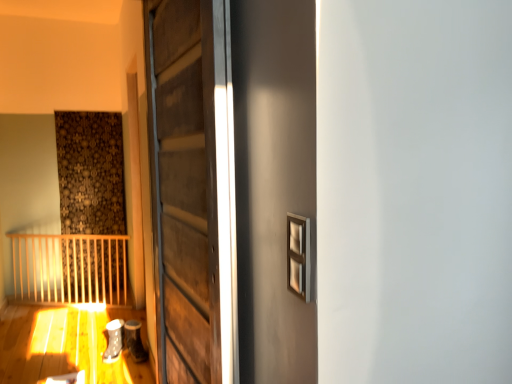
Question: Is wooden door at center positioned in front of white matte shoe at lower left, the 2th shoe positioned from the right?

Choices:
 (A) yes
 (B) no

Answer: (A)

Question: Can you confirm if wooden door at center is taller than white matte shoe at lower left, the 2th shoe positioned from the right?

Choices:
 (A) no
 (B) yes

Answer: (B)

Question: Considering the relative sizes of wooden door at center and white matte shoe at lower left, the 2th shoe positioned from the right, in the image provided, is wooden door at center shorter than white matte shoe at lower left, the 2th shoe positioned from the right,?

Choices:
 (A) no
 (B) yes

Answer: (A)

Question: Considering the relative sizes of wooden door at center and white matte shoe at lower left, acting as the first shoe starting from the left, in the image provided, is wooden door at center thinner than white matte shoe at lower left, acting as the first shoe starting from the left,?

Choices:
 (A) yes
 (B) no

Answer: (A)

Question: From a real-world perspective, is wooden door at center physically above white matte shoe at lower left, acting as the first shoe starting from the left?

Choices:
 (A) no
 (B) yes

Answer: (B)

Question: From their relative heights in the image, would you say matte gray shoe at lower left, the first shoe from the right, is taller or shorter than wooden door at center?

Choices:
 (A) tall
 (B) short

Answer: (B)

Question: Is matte gray shoe at lower left, the first shoe from the right, wider or thinner than wooden door at center?

Choices:
 (A) thin
 (B) wide

Answer: (B)

Question: Visually, is matte gray shoe at lower left, the 2th shoe in the left-to-right sequence, positioned to the left or to the right of wooden door at center?

Choices:
 (A) right
 (B) left

Answer: (B)

Question: Is matte gray shoe at lower left, the 2th shoe in the left-to-right sequence, in front of or behind wooden door at center in the image?

Choices:
 (A) front
 (B) behind

Answer: (B)

Question: Considering the positions of matte gray shoe at lower left, the first shoe from the right, and white matte shoe at lower left, the 2th shoe positioned from the right, in the image, is matte gray shoe at lower left, the first shoe from the right, bigger or smaller than white matte shoe at lower left, the 2th shoe positioned from the right,?

Choices:
 (A) big
 (B) small

Answer: (A)

Question: Is point (143, 352) positioned closer to the camera than point (118, 339)?

Choices:
 (A) closer
 (B) farther

Answer: (B)

Question: From the image's perspective, is matte gray shoe at lower left, the first shoe from the right, located above or below white matte shoe at lower left, the 2th shoe positioned from the right?

Choices:
 (A) above
 (B) below

Answer: (A)

Question: Is matte gray shoe at lower left, the 2th shoe in the left-to-right sequence, wider or thinner than white matte shoe at lower left, acting as the first shoe starting from the left?

Choices:
 (A) thin
 (B) wide

Answer: (A)

Question: Considering the positions of white matte shoe at lower left, acting as the first shoe starting from the left, and matte gray shoe at lower left, the 2th shoe in the left-to-right sequence, in the image, is white matte shoe at lower left, acting as the first shoe starting from the left, bigger or smaller than matte gray shoe at lower left, the 2th shoe in the left-to-right sequence,?

Choices:
 (A) big
 (B) small

Answer: (B)

Question: Is point (106, 355) positioned closer to the camera than point (126, 326)?

Choices:
 (A) closer
 (B) farther

Answer: (A)